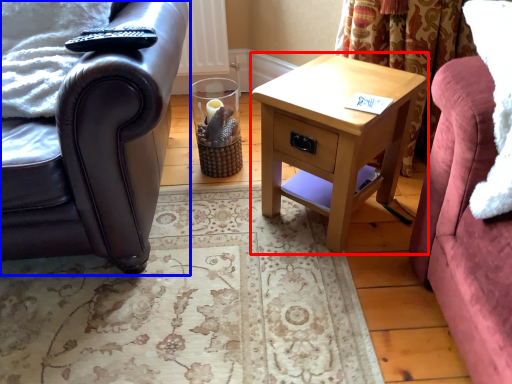
Question: Among these objects, which one is nearest to the camera, nightstand (highlighted by a red box) or chair (highlighted by a blue box)?

Choices:
 (A) nightstand
 (B) chair

Answer: (B)